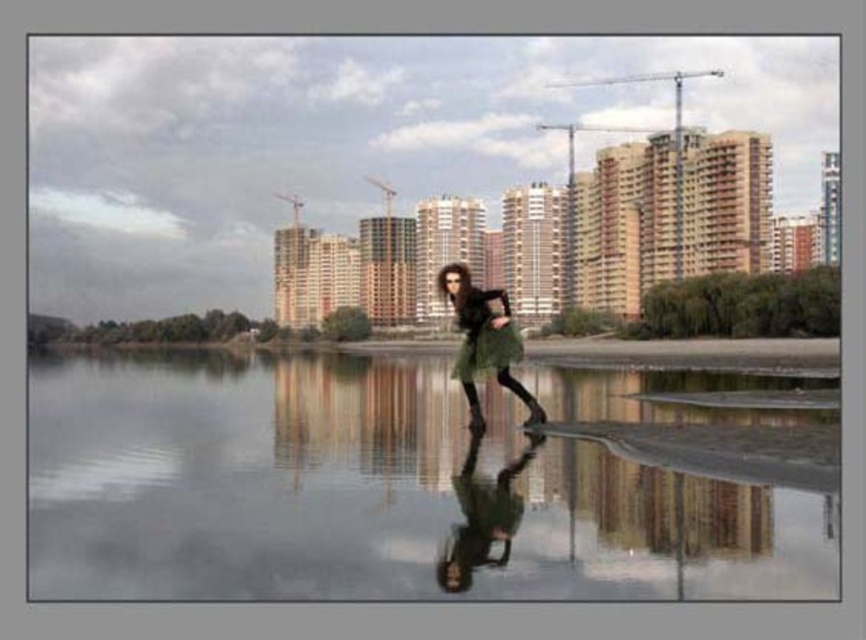
You are a photographer planning to take a photo of the green fabric dress at center and the green matte skirt at center. The minimum distance your camera can focus on two objects is 15 meters. Will the camera be able to capture both objects clearly in the same photo?

The distance between the green fabric dress at center and the green matte skirt at center is 15.24 meters. Since the minimum focusing distance is 15 meters, the camera can capture both objects clearly as the distance exceeds the required minimum.

You are a fashion designer observing the woman in the image. You notice she is wearing a green fabric dress at center and a green matte skirt at center. Which of these two items has a wider silhouette?

The green matte skirt at center has a wider silhouette than the green fabric dress at center, as the dress is narrower in width compared to the skirt.

You are a photographer trying to capture the reflection of the woman in the water. Given that the green reflective water at center is wider than the green matte skirt at center, which object will occupy more space in your photo?

The green reflective water at center will occupy more space in the photo because its width surpasses that of the green matte skirt at center.